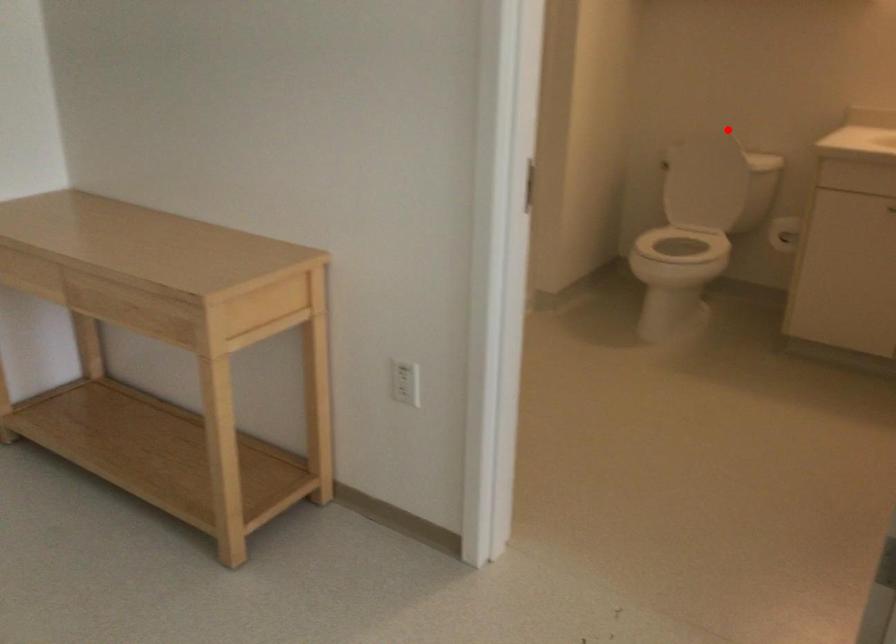
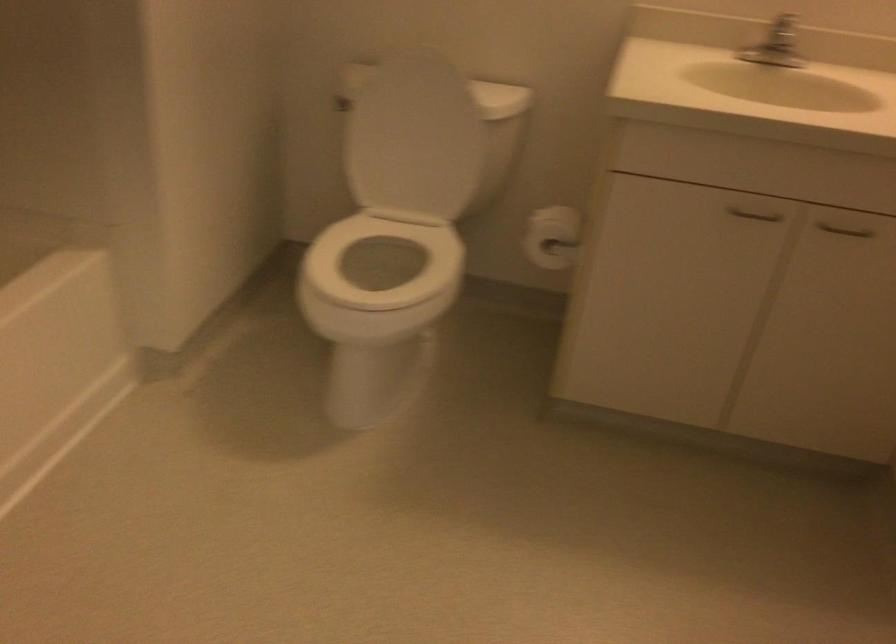
Question: I am providing you with two images of the same scene from different viewpoints. In image1, a red point is highlighted. Considering the same 3D point in image2, which of the following is correct?

Choices:
 (A) It is closer
 (B) It is farther

Answer: (A)